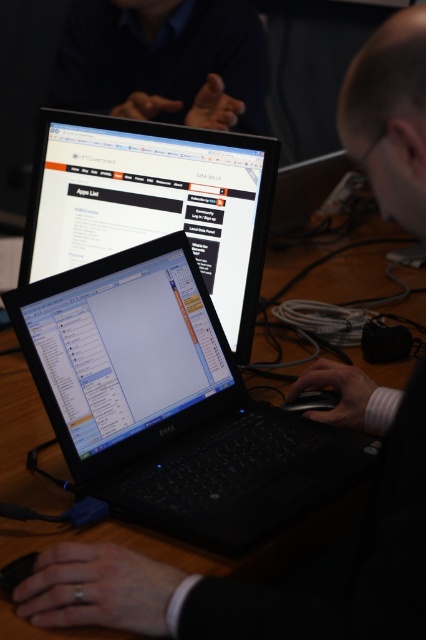
Question: Does black matte laptop at center have a lesser width compared to matte black laptop at center?

Choices:
 (A) no
 (B) yes

Answer: (A)

Question: Can you confirm if black glossy laptop at center is smaller than dark blue shirt at upper center?

Choices:
 (A) yes
 (B) no

Answer: (A)

Question: Which point is farther from the camera taking this photo?

Choices:
 (A) (244, 4)
 (B) (115, 356)

Answer: (A)

Question: Which object appears farthest from the camera in this image?

Choices:
 (A) matte black laptop at center
 (B) black glossy laptop at center
 (C) dark blue shirt at upper center
 (D) black matte laptop at center

Answer: (C)

Question: Which of the following is the farthest from the observer?

Choices:
 (A) (97, 99)
 (B) (60, 250)
 (C) (158, 266)
 (D) (69, 365)

Answer: (A)

Question: Can you confirm if black glossy laptop at center is wider than dark blue shirt at upper center?

Choices:
 (A) no
 (B) yes

Answer: (A)